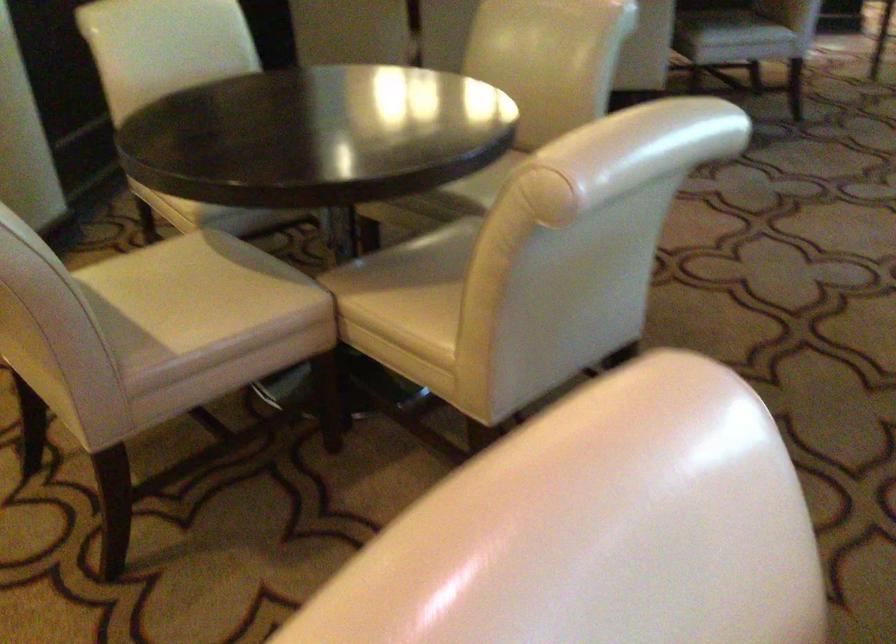
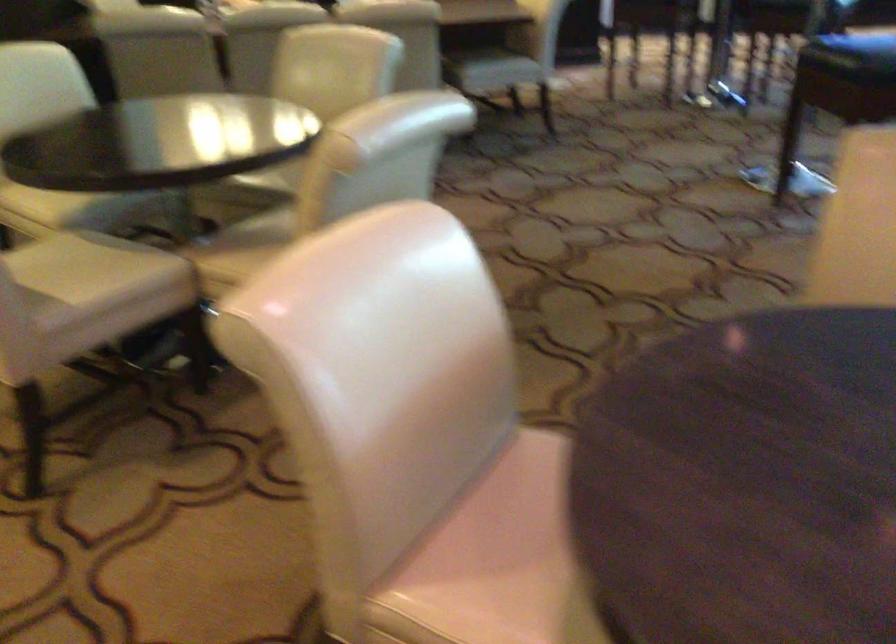
Question: The images are taken continuously from a first-person perspective. In which direction are you moving?

Choices:
 (A) Left
 (B) Right
 (C) Forward
 (D) Backward

Answer: (D)